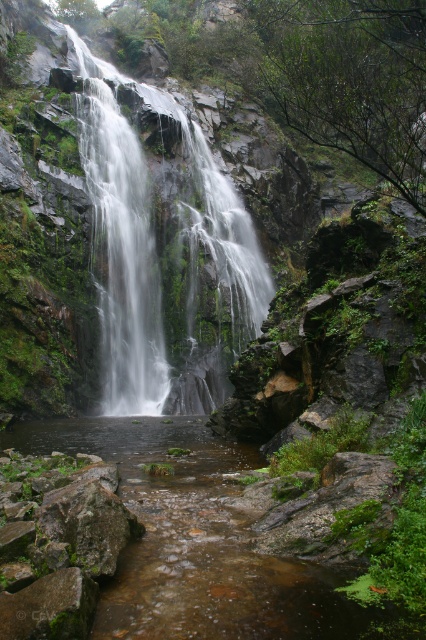
Question: Is clear water stream at center positioned behind clear water at center?

Choices:
 (A) yes
 (B) no

Answer: (B)

Question: Can you confirm if clear water stream at center is wider than clear water at center?

Choices:
 (A) no
 (B) yes

Answer: (A)

Question: Which of the following is the closest to the observer?

Choices:
 (A) (157, 339)
 (B) (137, 483)

Answer: (B)

Question: Can you confirm if clear water stream at center is thinner than clear water at center?

Choices:
 (A) yes
 (B) no

Answer: (A)